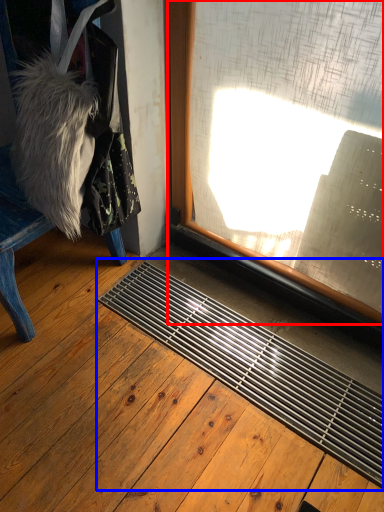
Question: Which of the following is the farthest to the observer, window (highlighted by a red box) or doormat (highlighted by a blue box)?

Choices:
 (A) window
 (B) doormat

Answer: (A)